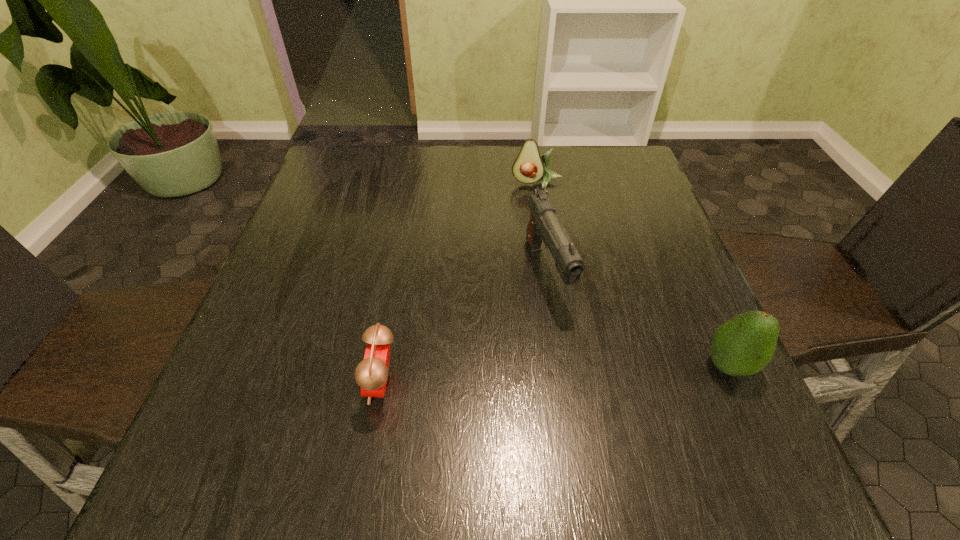
Locate an element on the screen. The width and height of the screenshot is (960, 540). free area in between the second farthest object and the right avocado is located at coordinates (637, 319).

This screenshot has width=960, height=540. What are the coordinates of `vacant area that lies between the nearer avocado and the third nearest object` in the screenshot? It's located at [637, 319].

Locate an element on the screen. Image resolution: width=960 pixels, height=540 pixels. empty space that is in between the nearer avocado and the farther avocado is located at coordinates (633, 275).

This screenshot has width=960, height=540. In order to click on free space between the leftmost object and the right avocado in this screenshot , I will do `click(555, 375)`.

This screenshot has width=960, height=540. Find the location of `empty location between the gun and the right avocado`. empty location between the gun and the right avocado is located at coordinates (637, 319).

Find the location of `empty space between the alarm clock and the second farthest object`. empty space between the alarm clock and the second farthest object is located at coordinates (465, 328).

Where is `empty space that is in between the nearer avocado and the left avocado`? The height and width of the screenshot is (540, 960). empty space that is in between the nearer avocado and the left avocado is located at coordinates (633, 275).

The width and height of the screenshot is (960, 540). What are the coordinates of `free space between the nearer avocado and the left avocado` in the screenshot? It's located at (633, 275).

Locate which object ranks in proximity to the alarm clock. Please provide its 2D coordinates. Your answer should be formatted as a tuple, i.e. [(x, y)], where the tuple contains the x and y coordinates of a point satisfying the conditions above.

[(544, 225)]

Locate an element on the screen. The image size is (960, 540). object that is the third closest to the leftmost object is located at coordinates (529, 167).